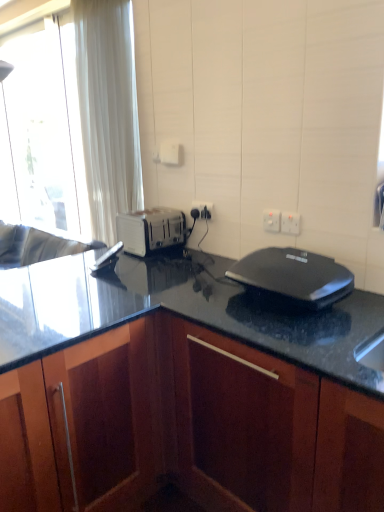
Question: From a real-world perspective, is black plastic sandwich maker at center beneath white curtain at left?

Choices:
 (A) yes
 (B) no

Answer: (A)

Question: Does black plastic sandwich maker at center have a smaller size compared to white curtain at left?

Choices:
 (A) no
 (B) yes

Answer: (B)

Question: Would you say white curtain at left is part of black plastic sandwich maker at center's contents?

Choices:
 (A) yes
 (B) no

Answer: (B)

Question: Does black plastic sandwich maker at center have a greater height compared to white curtain at left?

Choices:
 (A) yes
 (B) no

Answer: (B)

Question: From the image's perspective, would you say black plastic sandwich maker at center is shown under white curtain at left?

Choices:
 (A) yes
 (B) no

Answer: (A)

Question: Is white plastic electric outlet at upper right, marked as the 2th electric outlet in a front-to-back arrangement, wider or thinner than black plastic sandwich maker at center?

Choices:
 (A) wide
 (B) thin

Answer: (B)

Question: Would you say white plastic electric outlet at upper right, acting as the 2th electric outlet starting from the right, is to the left or to the right of black plastic sandwich maker at center in the picture?

Choices:
 (A) right
 (B) left

Answer: (B)

Question: Is point (266, 227) closer or farther from the camera than point (241, 267)?

Choices:
 (A) farther
 (B) closer

Answer: (A)

Question: From the image's perspective, relative to black plastic sandwich maker at center, is white plastic electric outlet at upper right, the second electric outlet viewed from the left, above or below?

Choices:
 (A) above
 (B) below

Answer: (A)

Question: Does point (268, 228) appear closer or farther from the camera than point (162, 208)?

Choices:
 (A) farther
 (B) closer

Answer: (B)

Question: From the image's perspective, is white plastic electric outlet at upper right, the second electric outlet viewed from the left, positioned above or below white plastic toaster at center?

Choices:
 (A) below
 (B) above

Answer: (B)

Question: In the image, is white plastic electric outlet at upper right, acting as the 2th electric outlet starting from the right, positioned in front of or behind white plastic toaster at center?

Choices:
 (A) behind
 (B) front

Answer: (B)

Question: Based on their positions, is white plastic electric outlet at upper right, acting as the 2th electric outlet starting from the right, located to the left or right of white plastic toaster at center?

Choices:
 (A) right
 (B) left

Answer: (A)

Question: Does point (175, 368) appear closer or farther from the camera than point (119, 232)?

Choices:
 (A) closer
 (B) farther

Answer: (A)

Question: Considering their positions, is dark wood cabinet at center located in front of or behind white plastic toaster at center?

Choices:
 (A) front
 (B) behind

Answer: (A)